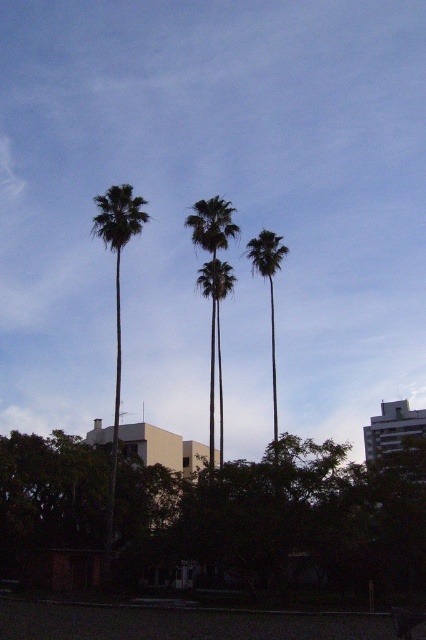
Is green leafy palm tree at left positioned in front of green leafy palm tree at center?

No.

Does green leafy palm tree at left have a lesser height compared to green leafy palm tree at center?

Correct, green leafy palm tree at left is not as tall as green leafy palm tree at center.

Is point (115, 449) positioned before point (267, 243)?

Yes.

Image resolution: width=426 pixels, height=640 pixels. In order to click on green leafy palm tree at left in this screenshot , I will do `click(117, 296)`.

Between green leafy tree at lower left and green leafy palm at center, which one has more height?

green leafy palm at center

Who is more forward, (420, 502) or (213, 454)?

Positioned in front is point (420, 502).

Where is `green leafy tree at lower left`? The width and height of the screenshot is (426, 640). green leafy tree at lower left is located at coordinates (278, 520).

At what (x,y) coordinates should I click in order to perform the action: click on green leafy tree at lower left. Please return your answer as a coordinate pair (x, y). This screenshot has width=426, height=640. Looking at the image, I should click on click(x=278, y=520).

Does green leafy palm at center have a smaller size compared to green leafy palm tree at center?

Indeed, green leafy palm at center has a smaller size compared to green leafy palm tree at center.

Who is more forward, (210,435) or (268,273)?

Point (268,273)

The image size is (426, 640). I want to click on green leafy palm at center, so click(212, 266).